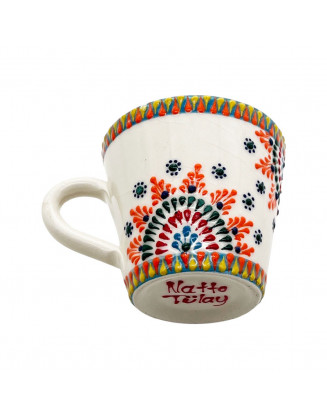
Locate an element on the screen. This screenshot has height=420, width=327. the bottom of mug is located at coordinates (236, 303).